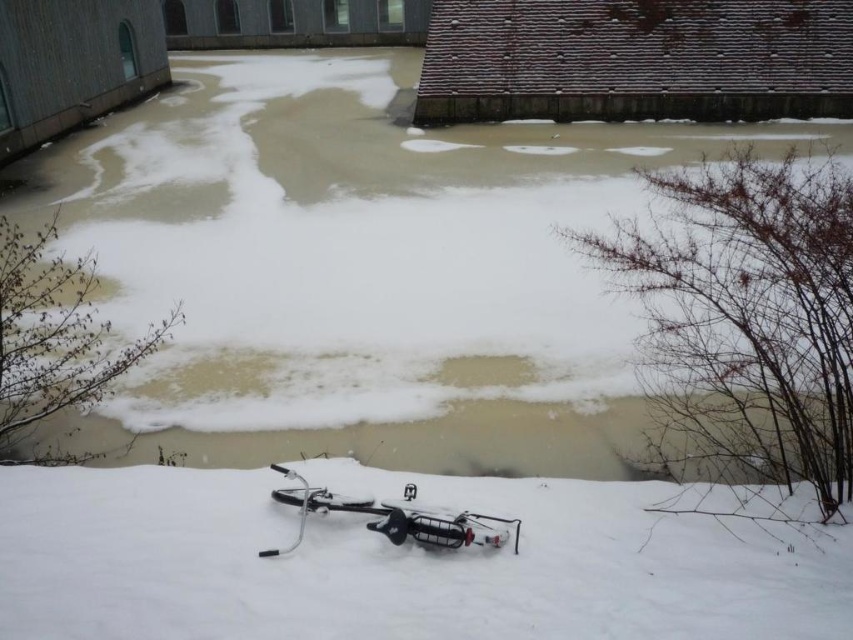
Measure the distance between point (495, 497) and camera.

Point (495, 497) and camera are 20.44 feet apart.

This screenshot has height=640, width=853. Identify the location of white fluffy snow at bottom. (393, 563).

Find the location of a particular element. white fluffy snow at bottom is located at coordinates (393, 563).

Who is shorter, white frothy water at center or silver metallic bicycle at lower center?

silver metallic bicycle at lower center

Describe the element at coordinates (363, 268) in the screenshot. I see `white frothy water at center` at that location.

Which is in front, point (614, 176) or point (360, 504)?

Point (360, 504)

You are a GUI agent. You are given a task and a screenshot of the screen. Output one action in this format:
    pyautogui.click(x=<x>, y=<y>)
    Task: Click on the white frothy water at center
    
    Given the screenshot: What is the action you would take?
    pyautogui.click(x=363, y=268)

Does white frothy water at center have a smaller size compared to white fluffy snow at bottom?

Actually, white frothy water at center might be larger than white fluffy snow at bottom.

Which is in front, point (263, 394) or point (163, 564)?

Point (163, 564) is in front.

You are a GUI agent. You are given a task and a screenshot of the screen. Output one action in this format:
    pyautogui.click(x=<x>, y=<y>)
    Task: Click on the white frothy water at center
    
    Given the screenshot: What is the action you would take?
    pyautogui.click(x=363, y=268)